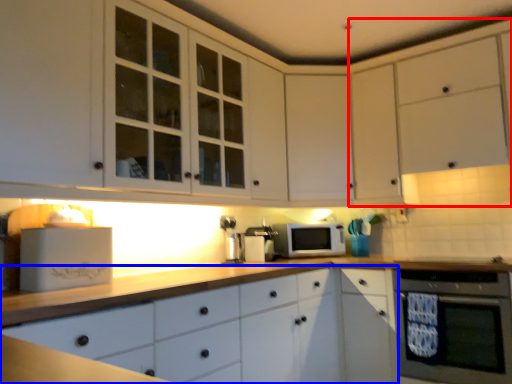
Question: Which of the following is the farthest to the observer, cabinetry (highlighted by a red box) or cabinetry (highlighted by a blue box)?

Choices:
 (A) cabinetry
 (B) cabinetry

Answer: (A)